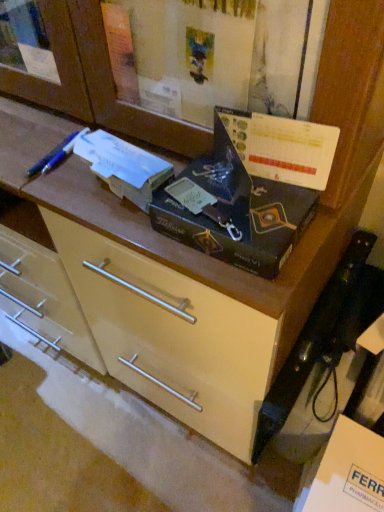
Locate an element on the screen. matte black box at center is located at coordinates (236, 209).

At what (x,y) coordinates should I click in order to perform the action: click on matte cream drawer at center. Please return your answer as a coordinate pair (x, y). This screenshot has height=512, width=384. Looking at the image, I should click on (171, 335).

This screenshot has width=384, height=512. Find the location of `white cardboard box at lower right`. white cardboard box at lower right is located at coordinates (349, 472).

Is white cardboard box at lower right far from matte cream drawer at center?

No, white cardboard box at lower right is not far away from matte cream drawer at center.

Where is `cardboard box that is below the matte cream drawer at center (from the image's perspective)`? cardboard box that is below the matte cream drawer at center (from the image's perspective) is located at coordinates (349, 472).

From the image's perspective, is white cardboard box at lower right above or below matte cream drawer at center?

white cardboard box at lower right is situated lower than matte cream drawer at center in the image.

Is white cardboard box at lower right located outside matte cream drawer at center?

Absolutely, white cardboard box at lower right is external to matte cream drawer at center.

Is white cardboard box at lower right at the back of blue plastic pen at upper left?

blue plastic pen at upper left does not have its back to white cardboard box at lower right.

Which object is positioned more to the left, blue plastic pen at upper left or white cardboard box at lower right?

From the viewer's perspective, blue plastic pen at upper left appears more on the left side.

Is blue plastic pen at upper left in contact with white cardboard box at lower right?

No, blue plastic pen at upper left is not next to white cardboard box at lower right.

Is blue plastic pen at upper left situated inside white cardboard box at lower right or outside?

blue plastic pen at upper left is spatially situated outside white cardboard box at lower right.

Does matte cream drawer at center touch blue plastic pen at upper left?

matte cream drawer at center and blue plastic pen at upper left are clearly separated.

Is blue plastic pen at upper left inside matte cream drawer at center?

That's incorrect, blue plastic pen at upper left is not inside matte cream drawer at center.

In the scene shown: How far apart are matte cream drawer at center and blue plastic pen at upper left?

matte cream drawer at center is 15.22 inches away from blue plastic pen at upper left.

Considering the positions of objects matte cream drawer at center and blue plastic pen at upper left in the image provided, who is more to the left, matte cream drawer at center or blue plastic pen at upper left?

Positioned to the left is blue plastic pen at upper left.

What are the coordinates of `penguin on the left side of matte black box at center` in the screenshot? It's located at (56, 155).

Is matte black box at center positioned with its back to blue plastic pen at upper left?

matte black box at center does not have its back to blue plastic pen at upper left.

Can we say matte black box at center lies outside blue plastic pen at upper left?

That's correct, matte black box at center is outside of blue plastic pen at upper left.

Would you say blue plastic pen at upper left contains matte cream drawer at center?

That's incorrect, matte cream drawer at center is not inside blue plastic pen at upper left.

Measure the distance between blue plastic pen at upper left and matte cream drawer at center.

blue plastic pen at upper left and matte cream drawer at center are 15.22 inches apart from each other.

Is blue plastic pen at upper left wider or thinner than matte cream drawer at center?

Considering their sizes, blue plastic pen at upper left looks slimmer than matte cream drawer at center.

Is matte cream drawer at center at the back of blue plastic pen at upper left?

No.

Considering the positions of point (210, 227) and point (310, 503), is point (210, 227) closer or farther from the camera than point (310, 503)?

Point (210, 227) is positioned closer to the camera compared to point (310, 503).

From a real-world perspective, between matte black box at center and white cardboard box at lower right, who is vertically lower?

From a 3D spatial view, white cardboard box at lower right is below.

From the image's perspective, does matte black box at center appear higher than white cardboard box at lower right?

Correct, matte black box at center appears higher than white cardboard box at lower right in the image.

The image size is (384, 512). I want to click on box above the white cardboard box at lower right (from the image's perspective), so click(x=236, y=209).

Is matte cream drawer at center positioned far away from white cardboard box at lower right?

No, matte cream drawer at center is not far away from white cardboard box at lower right.

From the image's perspective, between matte cream drawer at center and white cardboard box at lower right, which one is located above?

matte cream drawer at center appears higher in the image.

Looking at this image, is matte cream drawer at center looking in the opposite direction of white cardboard box at lower right?

No, matte cream drawer at center's orientation is not away from white cardboard box at lower right.

Where is `cardboard box above the matte cream drawer at center (from a real-world perspective)`? This screenshot has height=512, width=384. cardboard box above the matte cream drawer at center (from a real-world perspective) is located at coordinates (349, 472).

This screenshot has height=512, width=384. I want to click on cardboard box below the blue plastic pen at upper left (from a real-world perspective), so click(349, 472).

From the image, which object appears to be nearer to white cardboard box at lower right, matte black box at center or matte cream drawer at center?

matte cream drawer at center.

From the image, which object appears to be nearer to white cardboard box at lower right, blue plastic pen at upper left or matte cream drawer at center?

The object closer to white cardboard box at lower right is matte cream drawer at center.

Considering their positions, is matte cream drawer at center positioned further to matte black box at center than blue plastic pen at upper left?

Based on the image, blue plastic pen at upper left appears to be further to matte black box at center.

Considering their positions, is matte cream drawer at center positioned closer to white cardboard box at lower right than blue plastic pen at upper left?

matte cream drawer at center lies closer to white cardboard box at lower right than the other object.

Which object lies further to the anchor point white cardboard box at lower right, matte cream drawer at center or matte black box at center?

matte black box at center lies further to white cardboard box at lower right than the other object.

When comparing their distances from matte black box at center, does blue plastic pen at upper left or white cardboard box at lower right seem closer?

blue plastic pen at upper left is closer to matte black box at center.

Considering their positions, is matte black box at center positioned closer to matte cream drawer at center than blue plastic pen at upper left?

matte black box at center lies closer to matte cream drawer at center than the other object.

Estimate the real-world distances between objects in this image. Which object is further from blue plastic pen at upper left, white cardboard box at lower right or matte cream drawer at center?

white cardboard box at lower right lies further to blue plastic pen at upper left than the other object.

This screenshot has height=512, width=384. Find the location of `box between blue plastic pen at upper left and white cardboard box at lower right vertically`. box between blue plastic pen at upper left and white cardboard box at lower right vertically is located at coordinates (236, 209).

Image resolution: width=384 pixels, height=512 pixels. Identify the location of box between blue plastic pen at upper left and matte cream drawer at center vertically. (236, 209).

At what (x,y) coordinates should I click in order to perform the action: click on drawer between matte black box at center and white cardboard box at lower right vertically. Please return your answer as a coordinate pair (x, y). This screenshot has height=512, width=384. Looking at the image, I should click on (171, 335).

Where is `drawer between blue plastic pen at upper left and white cardboard box at lower right in the vertical direction`? The height and width of the screenshot is (512, 384). drawer between blue plastic pen at upper left and white cardboard box at lower right in the vertical direction is located at coordinates (171, 335).